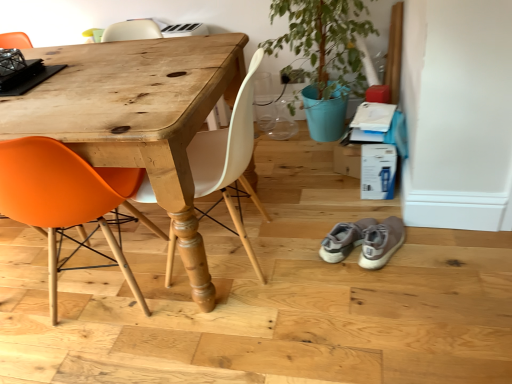
What do you see at coordinates (63, 200) in the screenshot? The width and height of the screenshot is (512, 384). I see `orange matte chair at left, which is the 1th chair in left-to-right order` at bounding box center [63, 200].

What do you see at coordinates (324, 57) in the screenshot? This screenshot has height=384, width=512. I see `green matte potted plant at upper right` at bounding box center [324, 57].

Measure the distance between matte white chair at center, arranged as the 1th chair when viewed from the right, and camera.

The distance of matte white chair at center, arranged as the 1th chair when viewed from the right, from camera is 4.21 feet.

Find the location of a particular element. orange matte chair at left, which is the second chair in right-to-left order is located at coordinates (63, 200).

Considering the positions of objects green matte potted plant at upper right and orange matte chair at left, which is the second chair in right-to-left order, in the image provided, who is more to the right, green matte potted plant at upper right or orange matte chair at left, which is the second chair in right-to-left order,?

Positioned to the right is green matte potted plant at upper right.

Is point (314, 85) in front of point (141, 295)?

No, it is not.

In the scene shown: Between green matte potted plant at upper right and orange matte chair at left, which is the second chair in right-to-left order, which one has larger width?

Wider between the two is orange matte chair at left, which is the second chair in right-to-left order.

Who is smaller, green matte potted plant at upper right or orange matte chair at left, which is the second chair in right-to-left order?

With smaller size is orange matte chair at left, which is the second chair in right-to-left order.

Between orange matte chair at left, which is the 1th chair in left-to-right order, and green matte potted plant at upper right, which one has smaller width?

With smaller width is green matte potted plant at upper right.

Which of these two, orange matte chair at left, which is the second chair in right-to-left order, or green matte potted plant at upper right, stands taller?

green matte potted plant at upper right is taller.

Is orange matte chair at left, which is the second chair in right-to-left order, not inside green matte potted plant at upper right?

Yes, orange matte chair at left, which is the second chair in right-to-left order, is not within green matte potted plant at upper right.

Is orange matte chair at left, which is the 1th chair in left-to-right order, oriented towards green matte potted plant at upper right?

No, orange matte chair at left, which is the 1th chair in left-to-right order, is not turned towards green matte potted plant at upper right.

Would you say matte white chair at center, arranged as the 1th chair when viewed from the right, is to the left or to the right of green matte potted plant at upper right in the picture?

matte white chair at center, arranged as the 1th chair when viewed from the right, is to the left of green matte potted plant at upper right.

Is matte white chair at center, the 2th chair viewed from the left, inside the boundaries of green matte potted plant at upper right, or outside?

matte white chair at center, the 2th chair viewed from the left, is outside green matte potted plant at upper right.

Considering the sizes of matte white chair at center, arranged as the 1th chair when viewed from the right, and green matte potted plant at upper right in the image, is matte white chair at center, arranged as the 1th chair when viewed from the right, wider or thinner than green matte potted plant at upper right?

matte white chair at center, arranged as the 1th chair when viewed from the right, is thinner than green matte potted plant at upper right.

From a real-world perspective, relative to green matte potted plant at upper right, is matte white chair at center, the 2th chair viewed from the left, vertically above or below?

Clearly, from a real-world perspective, matte white chair at center, the 2th chair viewed from the left, is below green matte potted plant at upper right.

Which of these two, matte white chair at center, arranged as the 1th chair when viewed from the right, or orange matte chair at left, which is the 1th chair in left-to-right order, is wider?

With larger width is orange matte chair at left, which is the 1th chair in left-to-right order.

Is matte white chair at center, arranged as the 1th chair when viewed from the right, turned away from orange matte chair at left, which is the second chair in right-to-left order?

No, orange matte chair at left, which is the second chair in right-to-left order, is not at the back of matte white chair at center, arranged as the 1th chair when viewed from the right.

Considering the relative positions of matte white chair at center, arranged as the 1th chair when viewed from the right, and orange matte chair at left, which is the 1th chair in left-to-right order, in the image provided, is matte white chair at center, arranged as the 1th chair when viewed from the right, in front of orange matte chair at left, which is the 1th chair in left-to-right order,?

That is False.

Where is `chair on the left side of matte white chair at center, arranged as the 1th chair when viewed from the right`? chair on the left side of matte white chair at center, arranged as the 1th chair when viewed from the right is located at coordinates (63, 200).

From a real-world perspective, which object stands above the other?

From a 3D spatial view, green matte potted plant at upper right is above.

Can you confirm if green matte potted plant at upper right is thinner than matte white chair at center, the 2th chair viewed from the left?

Incorrect, the width of green matte potted plant at upper right is not less than that of matte white chair at center, the 2th chair viewed from the left.

Considering the positions of objects green matte potted plant at upper right and matte white chair at center, the 2th chair viewed from the left, in the image provided, who is more to the left, green matte potted plant at upper right or matte white chair at center, the 2th chair viewed from the left,?

Positioned to the left is matte white chair at center, the 2th chair viewed from the left.

Considering the relative sizes of green matte potted plant at upper right and matte white chair at center, the 2th chair viewed from the left, in the image provided, is green matte potted plant at upper right bigger than matte white chair at center, the 2th chair viewed from the left,?

Yes, green matte potted plant at upper right is bigger than matte white chair at center, the 2th chair viewed from the left.

Which is behind, point (47, 142) or point (248, 188)?

The point (248, 188) is behind.

Locate an element on the screen. chair on the right of orange matte chair at left, which is the 1th chair in left-to-right order is located at coordinates (229, 158).

Is orange matte chair at left, which is the 1th chair in left-to-right order, not within matte white chair at center, the 2th chair viewed from the left?

orange matte chair at left, which is the 1th chair in left-to-right order, lies outside matte white chair at center, the 2th chair viewed from the left,'s area.

From the image's perspective, does orange matte chair at left, which is the 1th chair in left-to-right order, appear lower than matte white chair at center, arranged as the 1th chair when viewed from the right?

Yes.

The height and width of the screenshot is (384, 512). Identify the location of houseplant to the right of orange matte chair at left, which is the 1th chair in left-to-right order. (324, 57).

Image resolution: width=512 pixels, height=384 pixels. Find the location of `the 2nd chair in front of the green matte potted plant at upper right, starting your count from the anchor`. the 2nd chair in front of the green matte potted plant at upper right, starting your count from the anchor is located at coordinates (63, 200).

From the image, which object appears to be nearer to green matte potted plant at upper right, matte white chair at center, the 2th chair viewed from the left, or orange matte chair at left, which is the 1th chair in left-to-right order?

matte white chair at center, the 2th chair viewed from the left, lies closer to green matte potted plant at upper right than the other object.

Based on their spatial positions, is green matte potted plant at upper right or matte white chair at center, the 2th chair viewed from the left, further from orange matte chair at left, which is the 1th chair in left-to-right order?

green matte potted plant at upper right lies further to orange matte chair at left, which is the 1th chair in left-to-right order, than the other object.

From the image, which object appears to be nearer to matte white chair at center, arranged as the 1th chair when viewed from the right, green matte potted plant at upper right or orange matte chair at left, which is the 1th chair in left-to-right order?

orange matte chair at left, which is the 1th chair in left-to-right order.

Estimate the real-world distances between objects in this image. Which object is further from orange matte chair at left, which is the second chair in right-to-left order, matte white chair at center, the 2th chair viewed from the left, or green matte potted plant at upper right?

Among the two, green matte potted plant at upper right is located further to orange matte chair at left, which is the second chair in right-to-left order.

When comparing their distances from green matte potted plant at upper right, does orange matte chair at left, which is the 1th chair in left-to-right order, or matte white chair at center, the 2th chair viewed from the left, seem closer?

matte white chair at center, the 2th chair viewed from the left, is closer to green matte potted plant at upper right.

Looking at this image, from the image, which object appears to be nearer to matte white chair at center, arranged as the 1th chair when viewed from the right, orange matte chair at left, which is the second chair in right-to-left order, or green matte potted plant at upper right?

Among the two, orange matte chair at left, which is the second chair in right-to-left order, is located nearer to matte white chair at center, arranged as the 1th chair when viewed from the right.

Where is `chair situated between orange matte chair at left, which is the 1th chair in left-to-right order, and green matte potted plant at upper right from left to right`? This screenshot has width=512, height=384. chair situated between orange matte chair at left, which is the 1th chair in left-to-right order, and green matte potted plant at upper right from left to right is located at coordinates (229, 158).